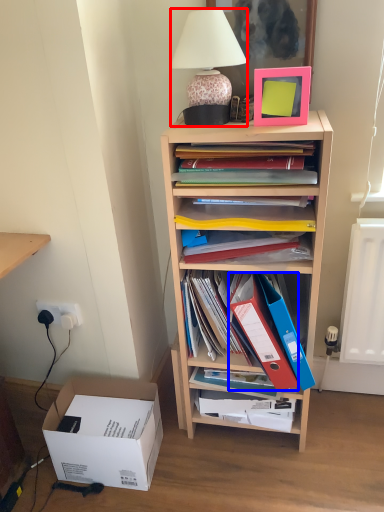
Question: Which of the following is the farthest to the observer, lamp (highlighted by a red box) or paperback book (highlighted by a blue box)?

Choices:
 (A) lamp
 (B) paperback book

Answer: (B)